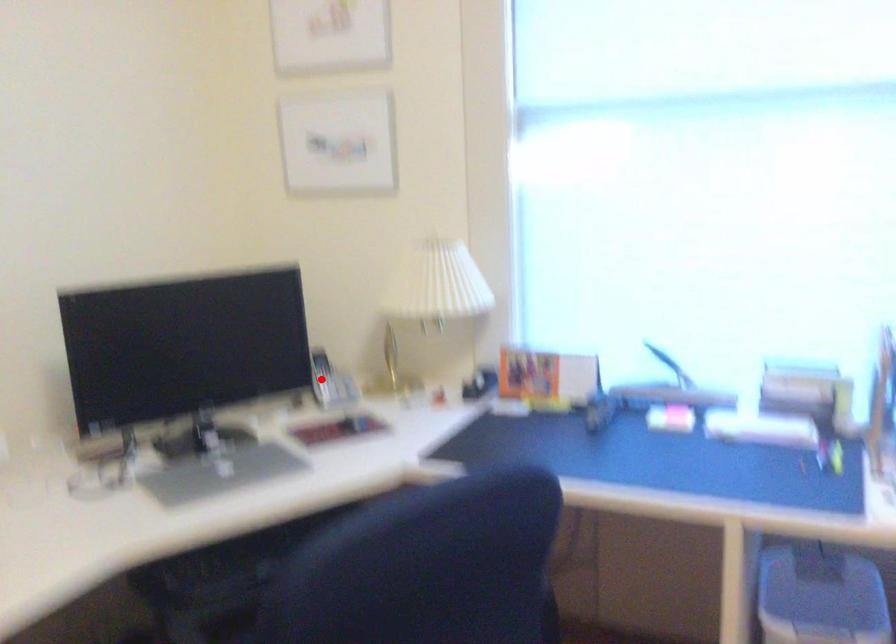
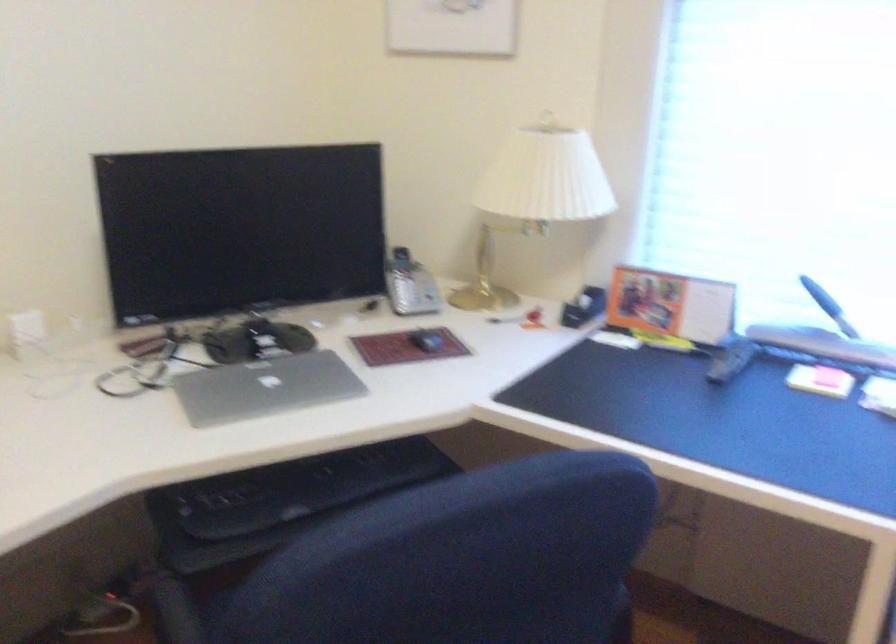
Where in the second image is the point corresponding to the highlighted location from the first image?

(401, 281)